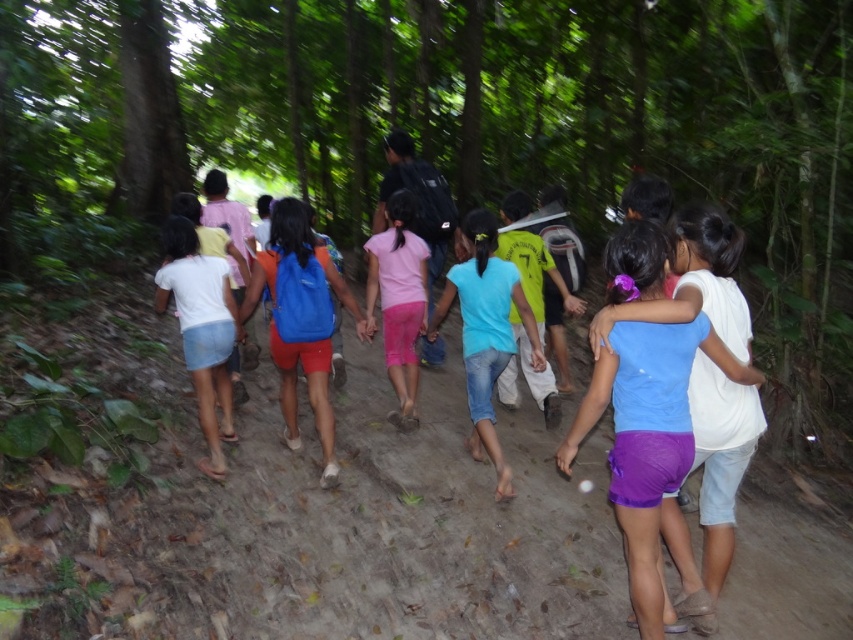
Question: Does white denim shorts at lower left have a greater width compared to pink matte shorts at center?

Choices:
 (A) no
 (B) yes

Answer: (B)

Question: Among these objects, which one is nearest to the camera?

Choices:
 (A) blue denim shorts at center
 (B) white denim shorts at lower left
 (C) blue fabric backpack at center

Answer: (A)

Question: Observing the image, what is the correct spatial positioning of white denim shorts at lower left in reference to pink matte shorts at center?

Choices:
 (A) above
 (B) below

Answer: (B)

Question: Among these points, which one is farthest from the camera?

Choices:
 (A) (294, 433)
 (B) (614, 244)
 (C) (538, 339)
 (D) (189, 266)

Answer: (A)

Question: Is matte blue shirt at center to the right of pink matte shorts at center from the viewer's perspective?

Choices:
 (A) yes
 (B) no

Answer: (A)

Question: Considering the real-world distances, which object is farthest from the blue denim shorts at center?

Choices:
 (A) matte blue shirt at center
 (B) blue fabric backpack at center
 (C) white denim shorts at lower left
 (D) pink matte shorts at center

Answer: (C)